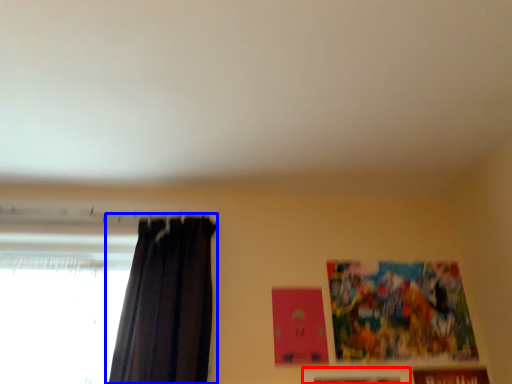
Question: Among these objects, which one is nearest to the camera, picture frame (highlighted by a red box) or curtain (highlighted by a blue box)?

Choices:
 (A) picture frame
 (B) curtain

Answer: (B)